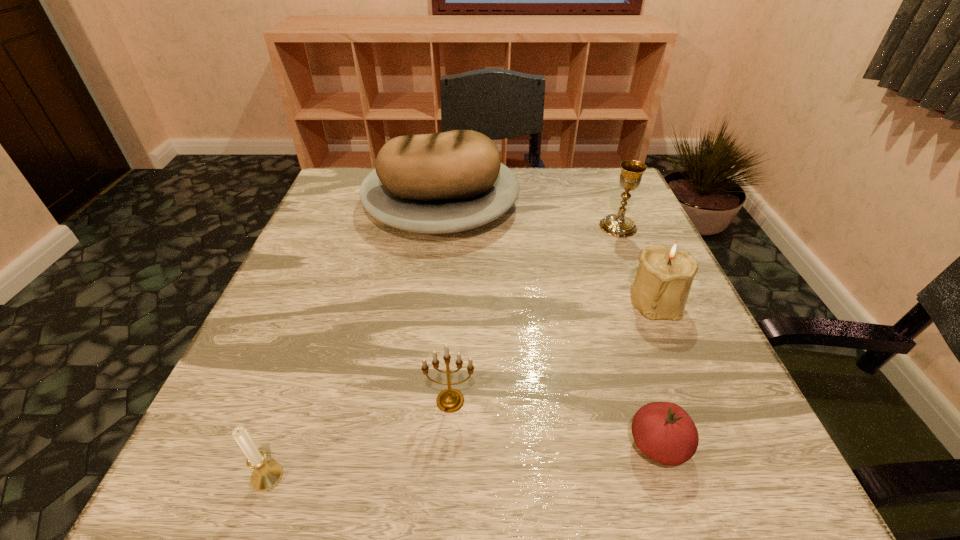
Find the location of `vacant space at the near left corner of the desktop`. vacant space at the near left corner of the desktop is located at coordinates (283, 463).

I want to click on free space at the far right corner of the desktop, so click(580, 167).

The height and width of the screenshot is (540, 960). I want to click on blank region between the shortest object and the fourth farthest object, so click(554, 423).

Find the location of a particular element. The width and height of the screenshot is (960, 540). vacant region between the third nearest object and the chalice is located at coordinates (534, 314).

Where is `vacant space that's between the chalice and the shortest object`? vacant space that's between the chalice and the shortest object is located at coordinates (638, 336).

The width and height of the screenshot is (960, 540). In order to click on free space between the nearest candle holder and the bread in this screenshot , I will do `click(354, 340)`.

Locate an element on the screen. The width and height of the screenshot is (960, 540). vacant area that lies between the leftmost candle holder and the bread is located at coordinates (354, 340).

At what (x,y) coordinates should I click in order to perform the action: click on vacant space that's between the third farthest object and the second farthest candle holder. Please return your answer as a coordinate pair (x, y). The height and width of the screenshot is (540, 960). Looking at the image, I should click on (554, 350).

Where is `vacant space that is in between the rightmost candle holder and the second farthest candle holder`? vacant space that is in between the rightmost candle holder and the second farthest candle holder is located at coordinates pyautogui.click(x=554, y=350).

Identify the location of vacant space that's between the fourth nearest object and the second candle holder from right to left. Image resolution: width=960 pixels, height=540 pixels. click(554, 350).